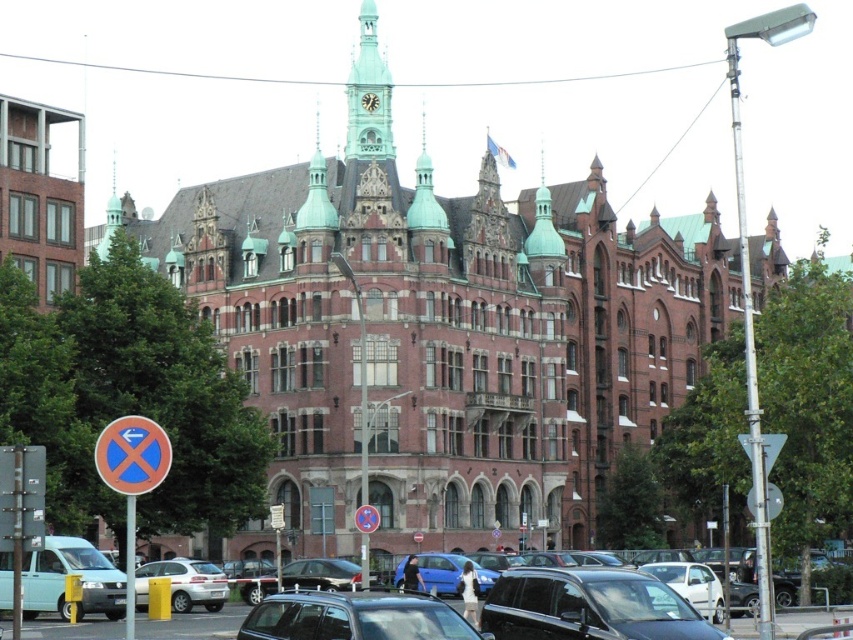
Question: Can you confirm if silver metallic sedan at lower center is positioned above red circular sign at center?

Choices:
 (A) no
 (B) yes

Answer: (A)

Question: Which point is closer to the camera?

Choices:
 (A) (387, 598)
 (B) (149, 442)
 (C) (141, 595)

Answer: (A)

Question: Is metallic silver car at center further to the viewer compared to red circular sign at center?

Choices:
 (A) yes
 (B) no

Answer: (B)

Question: Which of the following is the closest to the observer?

Choices:
 (A) (126, 460)
 (B) (218, 596)
 (C) (258, 602)

Answer: (A)

Question: Is blue circular sign at left to the left of silver metallic sedan at lower center from the viewer's perspective?

Choices:
 (A) no
 (B) yes

Answer: (A)

Question: Among these points, which one is nearest to the camera?

Choices:
 (A) (366, 532)
 (B) (445, 618)
 (C) (206, 593)

Answer: (B)